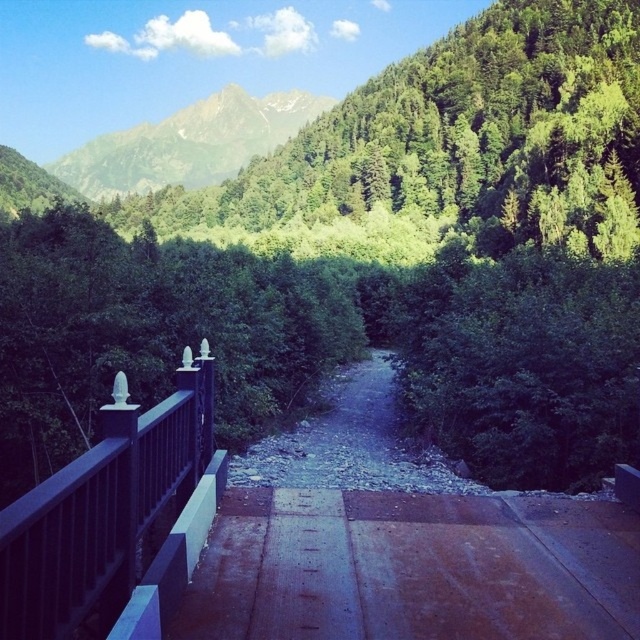
Who is higher up, rustic wooden path at center or green textured mountain at upper center?

green textured mountain at upper center is above.

Which is more to the left, rustic wooden path at center or green textured mountain at upper center?

green textured mountain at upper center

Where is `rustic wooden path at center`? The height and width of the screenshot is (640, 640). rustic wooden path at center is located at coordinates (413, 566).

Is point (140, 605) more distant than point (243, 92)?

No.

Who is more forward, (120, 436) or (83, 160)?

Point (120, 436)

Between point (49, 502) and point (96, 173), which one is positioned behind?

Positioned behind is point (96, 173).

You are a GUI agent. You are given a task and a screenshot of the screen. Output one action in this format:
    pyautogui.click(x=<x>, y=<y>)
    Task: Click on the black matte railing at left
    The height and width of the screenshot is (640, 640).
    Given the screenshot: What is the action you would take?
    pyautogui.click(x=116, y=518)

Is rustic wooden path at center wider than black matte railing at left?

Correct, the width of rustic wooden path at center exceeds that of black matte railing at left.

Who is lower down, rustic wooden path at center or black matte railing at left?

rustic wooden path at center

Does point (252, 566) come farther from viewer compared to point (61, 538)?

Yes.

Where is `rustic wooden path at center`? The height and width of the screenshot is (640, 640). rustic wooden path at center is located at coordinates coord(413,566).